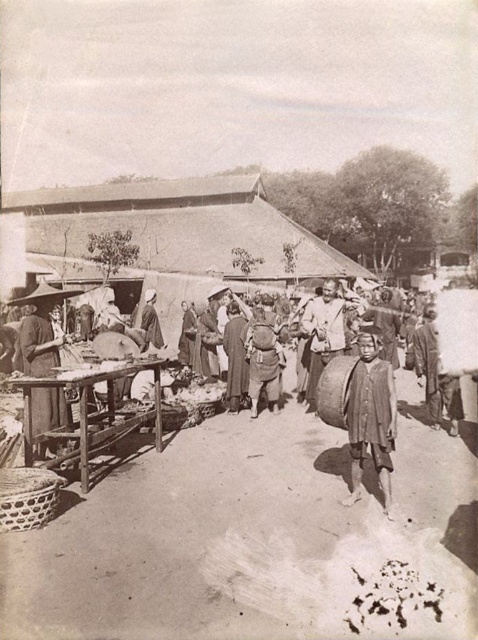
Question: Which point appears closest to the camera in this image?

Choices:
 (A) (150, 317)
 (B) (40, 426)
 (C) (358, 460)

Answer: (C)

Question: Which point appears closest to the camera in this image?

Choices:
 (A) (373, 424)
 (B) (144, 342)

Answer: (A)

Question: Can you confirm if brown fabric child at center is thinner than smooth wooden table at left?

Choices:
 (A) no
 (B) yes

Answer: (B)

Question: Is brown fabric child at center closer to camera compared to smooth brown hat at center?

Choices:
 (A) no
 (B) yes

Answer: (B)

Question: Estimate the real-world distances between objects in this image. Which object is closer to the smooth brown hat at center?

Choices:
 (A) brown fabric child at center
 (B) smooth wooden table at left

Answer: (B)

Question: From the image, what is the correct spatial relationship of brown fabric child at center in relation to smooth wooden table at left?

Choices:
 (A) above
 (B) below

Answer: (B)